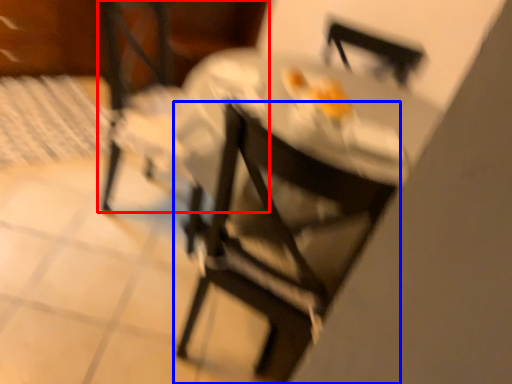
Question: Which object is further to the camera taking this photo, chair (highlighted by a red box) or chair (highlighted by a blue box)?

Choices:
 (A) chair
 (B) chair

Answer: (A)